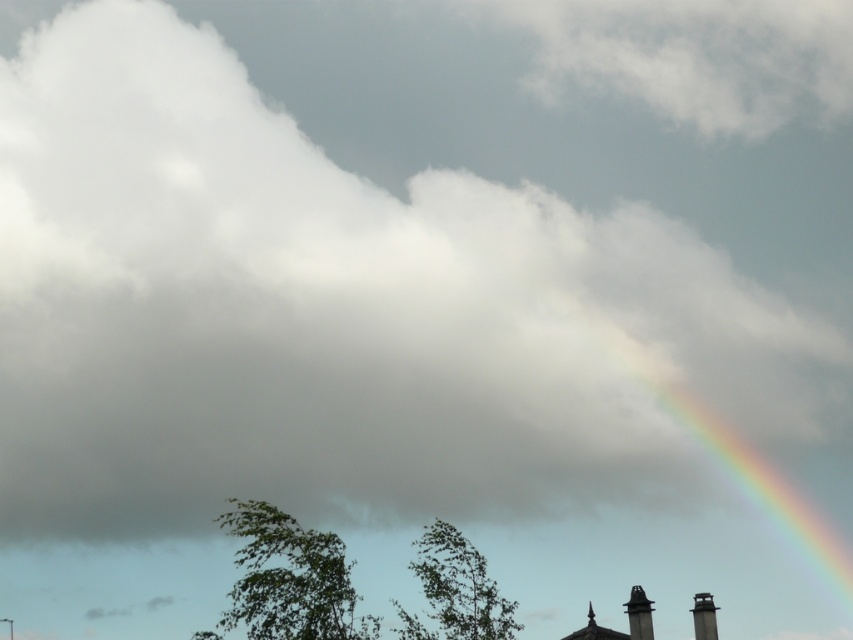
You are a bird looking for a nesting spot. You see the green leafy tree at center and the gray metallic chimney at lower right. Which one is taller to build a nest in?

The green leafy tree at center is taller than the gray metallic chimney at lower right, so you should choose the green leafy tree at center for nesting.

You are standing in the middle of the scene and want to walk towards the gray metallic chimney at lower right. Which direction should you move relative to the green leafy tree at center?

You should move to the right of the green leafy tree at center because the gray metallic chimney at lower right is positioned to the right side of the green leafy tree at center.

You are a bird looking for a perch. You see the green leafy tree at lower left and the gray metallic chimney at lower right. Which one is taller and would provide a better vantage point?

The green leafy tree at lower left is taller than the gray metallic chimney at lower right, so it would provide a better vantage point.